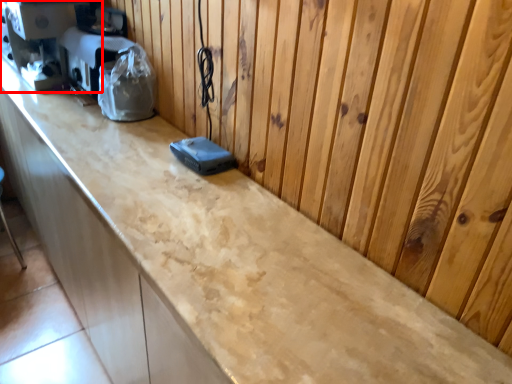
Question: In this image, where is coffee machine (annotated by the red box) located relative to appliance?

Choices:
 (A) right
 (B) left

Answer: (B)